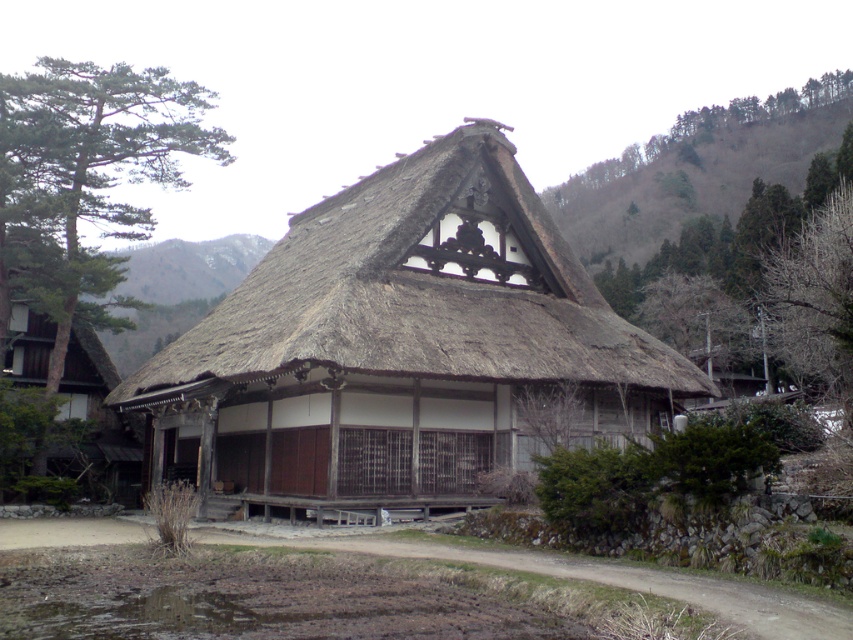
What do you see at coordinates (84, 180) in the screenshot? The width and height of the screenshot is (853, 640). I see `green leafy tree at left` at bounding box center [84, 180].

Between green leafy tree at left and wooden door at left, which one has less height?

wooden door at left

Is point (65, 328) positioned in front of point (77, 426)?

Yes, it is in front of point (77, 426).

I want to click on green leafy tree at left, so click(x=84, y=180).

Who is positioned more to the right, brown thatch at center or green leafy tree at left?

brown thatch at center is more to the right.

Is point (256, 352) more distant than point (79, 208)?

No, it is in front of (79, 208).

Locate an element on the screen. The image size is (853, 640). brown thatch at center is located at coordinates (416, 292).

Can you confirm if brown thatch at center is positioned to the left of wooden door at left?

In fact, brown thatch at center is to the right of wooden door at left.

Who is positioned more to the right, brown thatch at center or wooden door at left?

brown thatch at center is more to the right.

Describe the element at coordinates (416, 292) in the screenshot. The width and height of the screenshot is (853, 640). I see `brown thatch at center` at that location.

Locate an element on the screen. The image size is (853, 640). brown thatch at center is located at coordinates (416, 292).